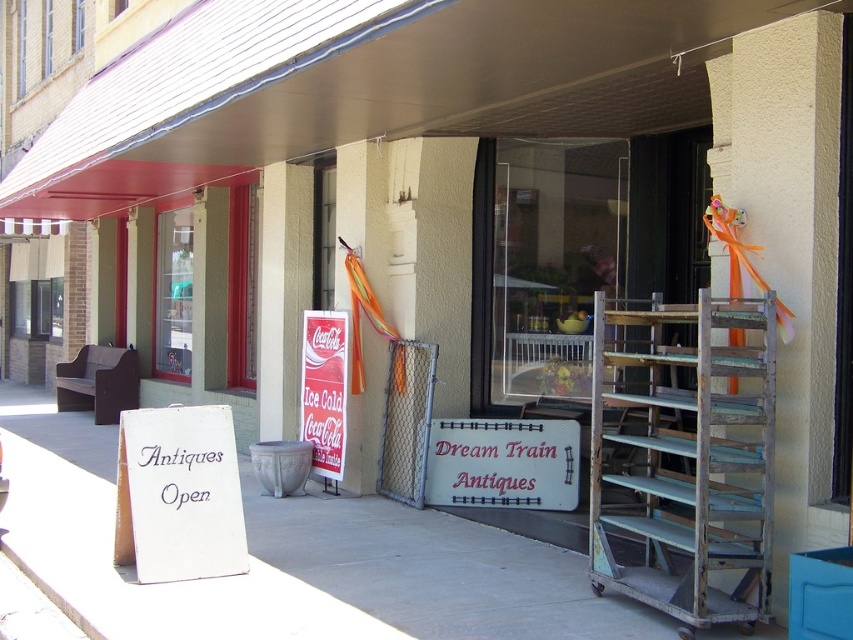
Question: Is rusty metal ladder at right to the right of white paper sign at lower left from the viewer's perspective?

Choices:
 (A) yes
 (B) no

Answer: (A)

Question: Can you confirm if rusty metal ladder at right is wider than red cardboard coca-cola sign at center?

Choices:
 (A) yes
 (B) no

Answer: (A)

Question: Among these points, which one is nearest to the camera?

Choices:
 (A) (321, 384)
 (B) (373, 508)

Answer: (B)

Question: Which point appears farthest from the camera in this image?

Choices:
 (A) (341, 380)
 (B) (177, 472)
 (C) (453, 604)

Answer: (A)

Question: Which object is the closest to the white wooden sign at center?

Choices:
 (A) white paper sign at lower left
 (B) rusty metal ladder at right
 (C) smooth concrete sidewalk at center

Answer: (C)

Question: From the image, what is the correct spatial relationship of smooth concrete sidewalk at center in relation to rusty metal ladder at right?

Choices:
 (A) above
 (B) below

Answer: (B)